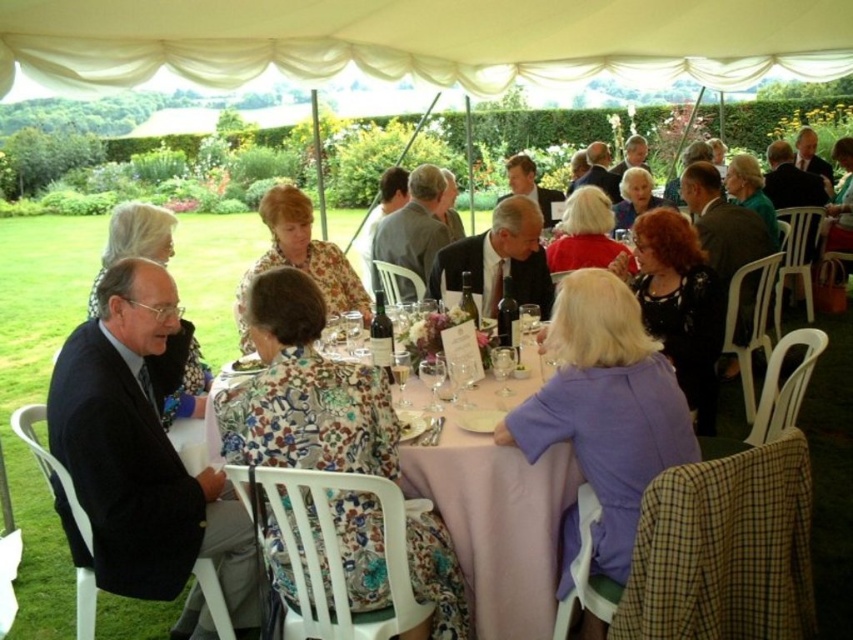
You are standing at the entrance of the tent and want to take a photo of the matte black suit at center without the white fabric canopy at upper center blocking the view. Is this possible?

The white fabric canopy at upper center is further to the viewer than matte black suit at center, so the canopy is closer to you. Therefore, you cannot take a photo of the matte black suit at center without the canopy blocking the view.

In the scene shown: You are a photographer at the event and want to capture a photo of the matte black suit at center without the white fabric canopy at upper center appearing in the background. Is this possible based on their positions?

The white fabric canopy at upper center is to the right of the matte black suit at center, so if you position yourself to the left side of the matte black suit at center, you can frame the shot so that the canopy is out of view.

You are a guest at the event and want to take a photo of the green leafy salad at center without including the white fabric canopy at upper center in the frame. Which direction should you move your camera to avoid the canopy?

Move the camera to the left, since the white fabric canopy at upper center is to the right of the green leafy salad at center.